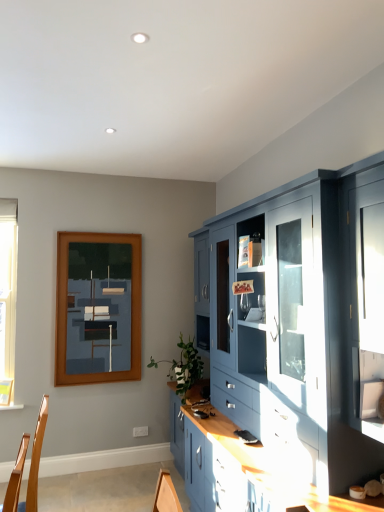
Find the location of a particular element. The width and height of the screenshot is (384, 512). wooden picture frame at upper left is located at coordinates (98, 308).

This screenshot has height=512, width=384. What do you see at coordinates (98, 308) in the screenshot?
I see `wooden picture frame at upper left` at bounding box center [98, 308].

Describe the element at coordinates (295, 339) in the screenshot. This screenshot has height=512, width=384. I see `matte blue cabinet at right` at that location.

Measure the distance between matte blue cabinet at right and camera.

matte blue cabinet at right and camera are 6.11 feet apart.

This screenshot has width=384, height=512. I want to click on matte blue cabinet at right, so click(x=295, y=339).

Where is `wooden picture frame at upper left`? The width and height of the screenshot is (384, 512). wooden picture frame at upper left is located at coordinates (98, 308).

Between wooden picture frame at upper left and matte blue cabinet at right, which one appears on the right side from the viewer's perspective?

matte blue cabinet at right.

Which object is closer to the camera taking this photo, wooden picture frame at upper left or matte blue cabinet at right?

matte blue cabinet at right is more forward.

Is point (95, 341) more distant than point (314, 486)?

Yes, point (95, 341) is farther from viewer.

From the image's perspective, which is below, wooden picture frame at upper left or matte blue cabinet at right?

matte blue cabinet at right, from the image's perspective.

From a real-world perspective, is wooden picture frame at upper left physically below matte blue cabinet at right?

No, from a real-world perspective, wooden picture frame at upper left is not below matte blue cabinet at right.

Considering the relative sizes of wooden picture frame at upper left and matte blue cabinet at right in the image provided, is wooden picture frame at upper left thinner than matte blue cabinet at right?

Yes, wooden picture frame at upper left is thinner than matte blue cabinet at right.

Can you confirm if wooden picture frame at upper left is shorter than matte blue cabinet at right?

Correct, wooden picture frame at upper left is not as tall as matte blue cabinet at right.

Does wooden picture frame at upper left have a larger size compared to matte blue cabinet at right?

Incorrect, wooden picture frame at upper left is not larger than matte blue cabinet at right.

Would you say wooden picture frame at upper left is outside matte blue cabinet at right?

wooden picture frame at upper left is positioned outside matte blue cabinet at right.

Is wooden picture frame at upper left not near matte blue cabinet at right?

Yes, wooden picture frame at upper left and matte blue cabinet at right are quite far apart.

Is wooden picture frame at upper left oriented towards matte blue cabinet at right?

No, wooden picture frame at upper left is not turned towards matte blue cabinet at right.

Locate an element on the screen. The width and height of the screenshot is (384, 512). cabinetry located in front of the wooden picture frame at upper left is located at coordinates (295, 339).

Would you say matte blue cabinet at right is to the left or to the right of wooden picture frame at upper left in the picture?

Clearly, matte blue cabinet at right is on the right of wooden picture frame at upper left in the image.

Considering their positions, is matte blue cabinet at right located in front of or behind wooden picture frame at upper left?

In the image, matte blue cabinet at right appears in front of wooden picture frame at upper left.

Does point (238, 355) come farther from viewer compared to point (138, 255)?

No, it is not.

From the image's perspective, would you say matte blue cabinet at right is shown under wooden picture frame at upper left?

Yes, from the image's perspective, matte blue cabinet at right is beneath wooden picture frame at upper left.

From a real-world perspective, which is physically above, matte blue cabinet at right or wooden picture frame at upper left?

From a 3D spatial view, wooden picture frame at upper left is above.

Can you confirm if matte blue cabinet at right is wider than wooden picture frame at upper left?

Yes, matte blue cabinet at right is wider than wooden picture frame at upper left.

Can you confirm if matte blue cabinet at right is shorter than wooden picture frame at upper left?

In fact, matte blue cabinet at right may be taller than wooden picture frame at upper left.

Who is bigger, matte blue cabinet at right or wooden picture frame at upper left?

matte blue cabinet at right.

Is matte blue cabinet at right located outside wooden picture frame at upper left?

That's correct, matte blue cabinet at right is outside of wooden picture frame at upper left.

Looking at this image, would you consider matte blue cabinet at right to be distant from wooden picture frame at upper left?

Absolutely, matte blue cabinet at right is distant from wooden picture frame at upper left.

Is matte blue cabinet at right facing away from wooden picture frame at upper left?

matte blue cabinet at right is not turned away from wooden picture frame at upper left.

You are a GUI agent. You are given a task and a screenshot of the screen. Output one action in this format:
    pyautogui.click(x=<x>, y=<y>)
    Task: Click on the cabinetry below the wooden picture frame at upper left (from the image's perspective)
    
    Given the screenshot: What is the action you would take?
    pyautogui.click(x=295, y=339)

I want to click on picture frame above the matte blue cabinet at right (from a real-world perspective), so click(x=98, y=308).

Where is `cabinetry on the right of wooden picture frame at upper left`? This screenshot has width=384, height=512. cabinetry on the right of wooden picture frame at upper left is located at coordinates (295, 339).